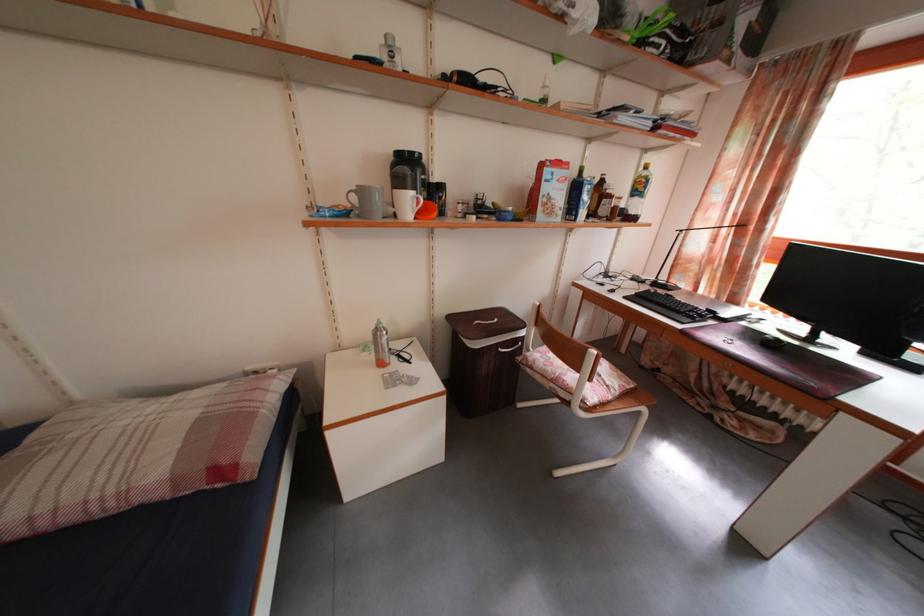
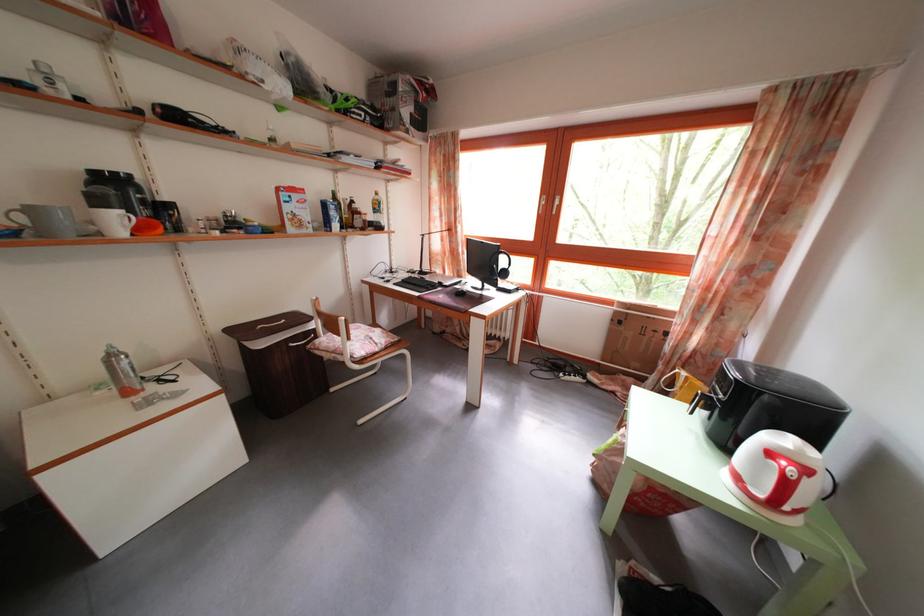
Locate, in the second image, the point that corresponds to (593,193) in the first image.

(338, 214)